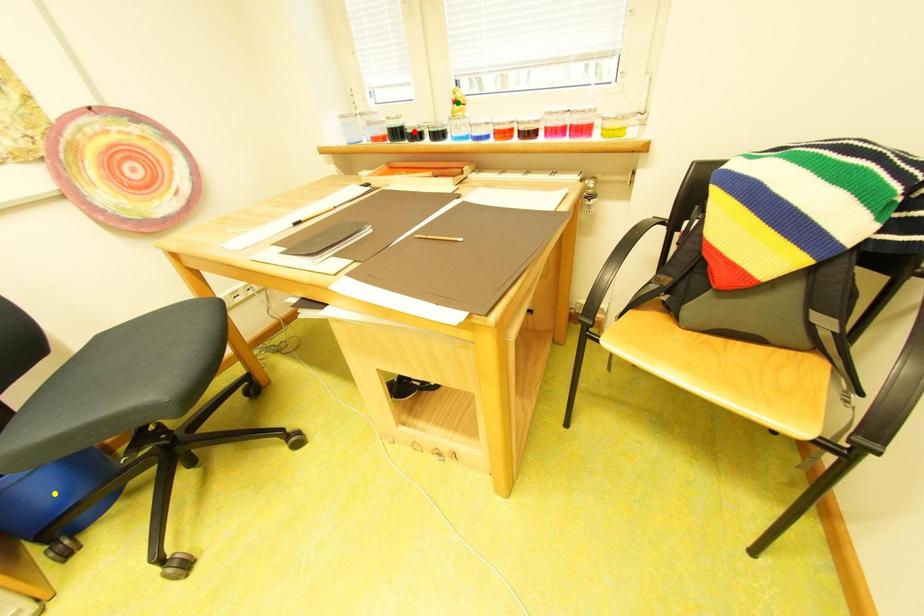
Order these from farthest to nearest:
A) green point
B) red point
C) yellow point

red point → green point → yellow point